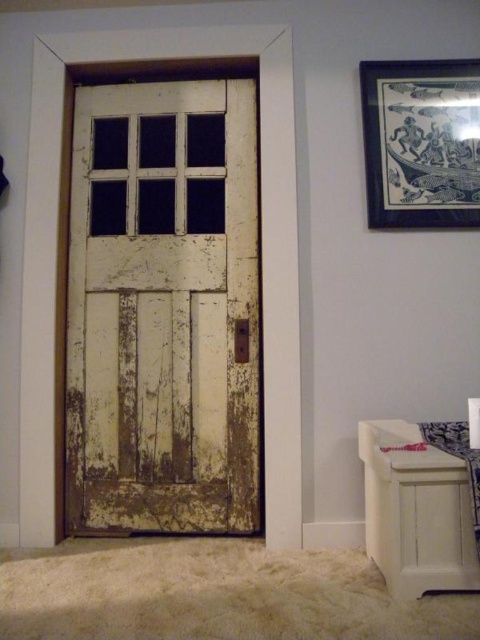
Between point (208, 212) and point (444, 205), which one is positioned in front?

Positioned in front is point (444, 205).

Can you confirm if white weathered wood door at center is wider than black paper picture frame at upper right?

Correct, the width of white weathered wood door at center exceeds that of black paper picture frame at upper right.

Measure the distance between white weathered wood door at center and camera.

white weathered wood door at center and camera are 7.10 feet apart.

You are a GUI agent. You are given a task and a screenshot of the screen. Output one action in this format:
    pyautogui.click(x=<x>, y=<y>)
    Task: Click on the white weathered wood door at center
    The width and height of the screenshot is (480, 640).
    Given the screenshot: What is the action you would take?
    pyautogui.click(x=164, y=308)